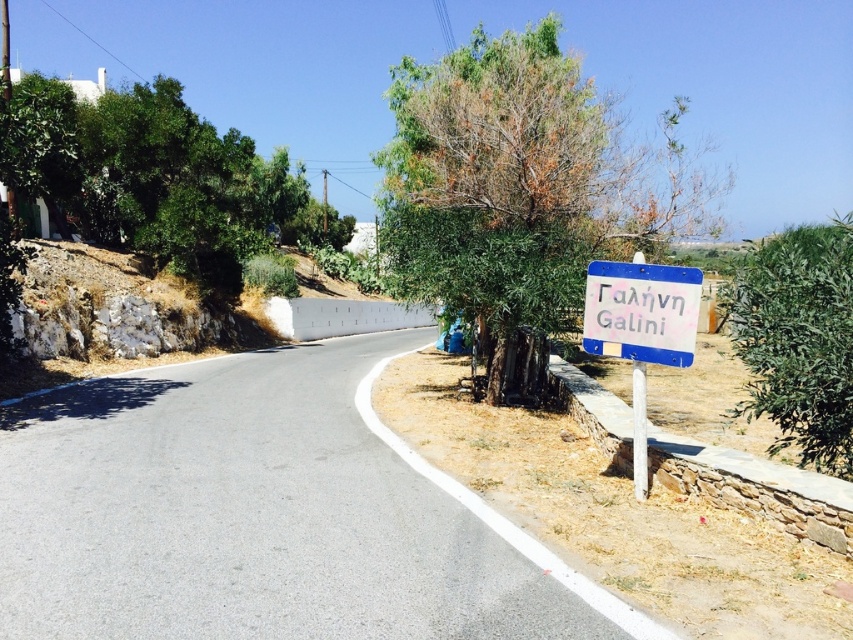
Can you confirm if gray asphalt road at center is taller than green leafy tree at upper left?

In fact, gray asphalt road at center may be shorter than green leafy tree at upper left.

Is gray asphalt road at center positioned in front of green leafy tree at upper left?

Yes, gray asphalt road at center is closer to the viewer.

Does point (70, 531) come behind point (140, 113)?

No, it is not.

This screenshot has height=640, width=853. Identify the location of gray asphalt road at center. (264, 515).

Is green leafy tree at upper left closer to the viewer compared to blue plastic sign at right?

No, green leafy tree at upper left is further to the viewer.

Which is behind, point (61, 163) or point (640, 352)?

Point (61, 163)

The height and width of the screenshot is (640, 853). Find the location of `green leafy tree at upper left`. green leafy tree at upper left is located at coordinates (154, 177).

Who is positioned more to the right, green leafy tree at center right or white plastic sign at right?

green leafy tree at center right

Who is positioned more to the left, green leafy tree at center right or white plastic sign at right?

white plastic sign at right

Who is more forward, (846, 285) or (610, 316)?

Positioned in front is point (846, 285).

Locate an element on the screen. The height and width of the screenshot is (640, 853). green leafy tree at center right is located at coordinates (799, 340).